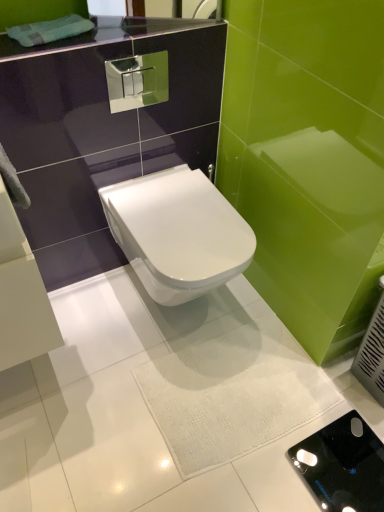
Measure the distance between white glossy toilet at center and camera.

1.18 meters.

Describe the element at coordinates (178, 233) in the screenshot. The image size is (384, 512). I see `white glossy toilet at center` at that location.

Where is `white glossy toilet at center`? This screenshot has height=512, width=384. white glossy toilet at center is located at coordinates (178, 233).

What do you see at coordinates (343, 465) in the screenshot?
I see `black glossy porcelain at center` at bounding box center [343, 465].

Measure the distance between point (336,433) and camera.

Point (336,433) and camera are 1.33 meters apart from each other.

Where is `black glossy porcelain at center`? The height and width of the screenshot is (512, 384). black glossy porcelain at center is located at coordinates (343, 465).

What are the coordinates of `white glossy toilet at center` in the screenshot? It's located at (178, 233).

Consider the image. Between black glossy porcelain at center and white glossy toilet at center, which one appears on the left side from the viewer's perspective?

white glossy toilet at center is more to the left.

Considering the positions of objects black glossy porcelain at center and white glossy toilet at center in the image provided, who is behind, black glossy porcelain at center or white glossy toilet at center?

Positioned behind is black glossy porcelain at center.

Is point (292, 457) closer or farther from the camera than point (145, 282)?

Point (292, 457) is closer to the camera than point (145, 282).

From the image's perspective, does black glossy porcelain at center appear lower than white glossy toilet at center?

Yes, from the image's perspective, black glossy porcelain at center is beneath white glossy toilet at center.

From a real-world perspective, is black glossy porcelain at center below white glossy toilet at center?

Yes, from a real-world perspective, black glossy porcelain at center is under white glossy toilet at center.

Considering the relative sizes of black glossy porcelain at center and white glossy toilet at center in the image provided, is black glossy porcelain at center thinner than white glossy toilet at center?

Indeed, black glossy porcelain at center has a lesser width compared to white glossy toilet at center.

Which of these two, black glossy porcelain at center or white glossy toilet at center, stands shorter?

black glossy porcelain at center is shorter.

Considering the relative sizes of black glossy porcelain at center and white glossy toilet at center in the image provided, is black glossy porcelain at center bigger than white glossy toilet at center?

Incorrect, black glossy porcelain at center is not larger than white glossy toilet at center.

Is white glossy toilet at center located within black glossy porcelain at center?

No, white glossy toilet at center is located outside of black glossy porcelain at center.

Is black glossy porcelain at center far away from white glossy toilet at center?

No, black glossy porcelain at center is not far from white glossy toilet at center.

Could you tell me if black glossy porcelain at center is turned towards white glossy toilet at center?

No, black glossy porcelain at center does not turn towards white glossy toilet at center.

I want to click on toilet above the black glossy porcelain at center (from the image's perspective), so click(x=178, y=233).

Which object is positioned more to the right, white glossy toilet at center or black glossy porcelain at center?

black glossy porcelain at center.

Based on the photo, which is in front, white glossy toilet at center or black glossy porcelain at center?

Positioned in front is white glossy toilet at center.

Is point (226, 207) in front of point (352, 433)?

No.

From the image's perspective, which is above, white glossy toilet at center or black glossy porcelain at center?

white glossy toilet at center appears higher in the image.

From a real-world perspective, which is physically above, white glossy toilet at center or black glossy porcelain at center?

white glossy toilet at center.

Which object is thinner, white glossy toilet at center or black glossy porcelain at center?

With smaller width is black glossy porcelain at center.

In terms of height, does white glossy toilet at center look taller or shorter compared to black glossy porcelain at center?

Considering their sizes, white glossy toilet at center has more height than black glossy porcelain at center.

Looking at this image, considering the sizes of objects white glossy toilet at center and black glossy porcelain at center in the image provided, who is smaller, white glossy toilet at center or black glossy porcelain at center?

black glossy porcelain at center is smaller.

Is white glossy toilet at center positioned beyond the bounds of black glossy porcelain at center?

Yes, white glossy toilet at center is outside of black glossy porcelain at center.

Does white glossy toilet at center touch black glossy porcelain at center?

No, white glossy toilet at center is not in contact with black glossy porcelain at center.

Is white glossy toilet at center facing away from black glossy porcelain at center?

white glossy toilet at center does not have its back to black glossy porcelain at center.

How many degrees apart are the facing directions of white glossy toilet at center and black glossy porcelain at center?

white glossy toilet at center and black glossy porcelain at center are facing 180 degrees away from each other.

How much distance is there between white glossy toilet at center and black glossy porcelain at center?

white glossy toilet at center is 29.10 inches away from black glossy porcelain at center.

Image resolution: width=384 pixels, height=512 pixels. What are the coordinates of `toilet that is in front of the black glossy porcelain at center` in the screenshot? It's located at (178, 233).

The image size is (384, 512). I want to click on toilet located on the left of black glossy porcelain at center, so click(178, 233).

There is a black glossy porcelain at center. At what (x,y) coordinates should I click in order to perform the action: click on toilet above it (from a real-world perspective). Please return your answer as a coordinate pair (x, y). The width and height of the screenshot is (384, 512). Looking at the image, I should click on (178, 233).